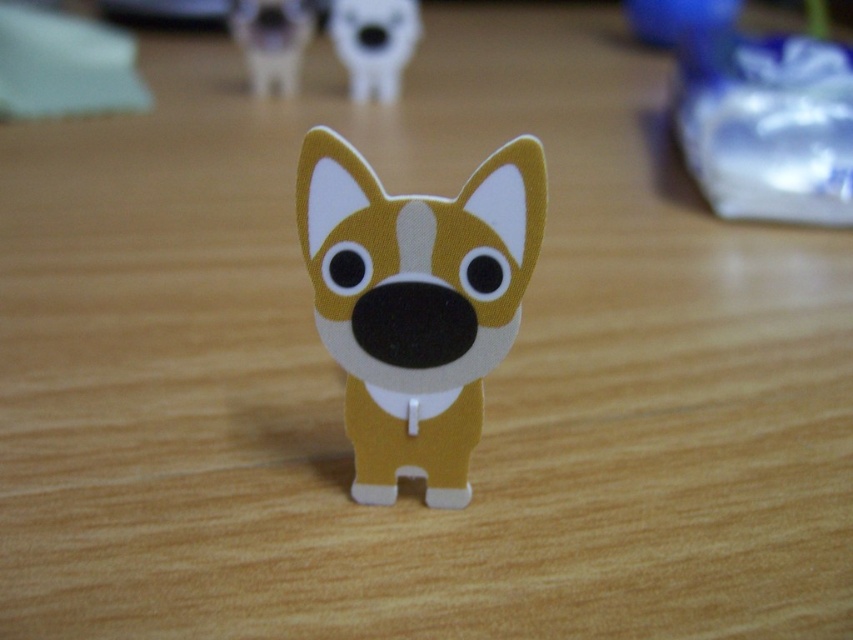
Is matte cardboard dog at center taller than matte cardboard dog at upper center?

Yes.

Which is in front, point (508, 188) or point (413, 35)?

Point (508, 188) is in front.

Image resolution: width=853 pixels, height=640 pixels. Identify the location of matte cardboard dog at center. (416, 301).

Is matte cardboard dog at center to the left of matte plastic dog at upper center from the viewer's perspective?

Incorrect, matte cardboard dog at center is not on the left side of matte plastic dog at upper center.

Is matte cardboard dog at center wider than matte plastic dog at upper center?

Yes, matte cardboard dog at center is wider than matte plastic dog at upper center.

Which is in front, point (383, 221) or point (260, 20)?

Positioned in front is point (383, 221).

Where is `matte cardboard dog at center`? This screenshot has height=640, width=853. matte cardboard dog at center is located at coordinates (416, 301).

Which is more to the left, matte cardboard dog at upper center or matte plastic dog at upper center?

matte plastic dog at upper center

Is matte cardboard dog at upper center thinner than matte plastic dog at upper center?

Incorrect, matte cardboard dog at upper center's width is not less than matte plastic dog at upper center's.

Where is `matte cardboard dog at upper center`? matte cardboard dog at upper center is located at coordinates (373, 44).